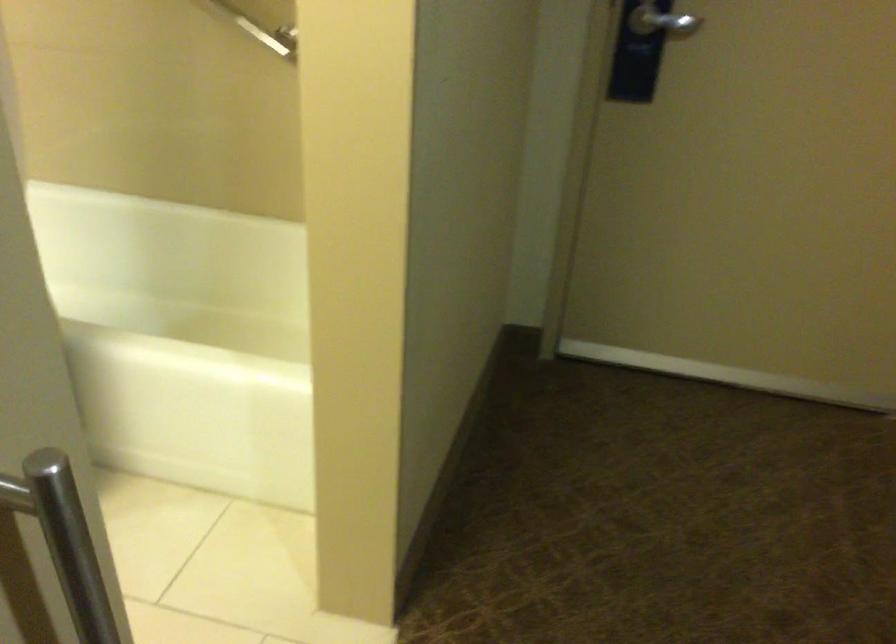
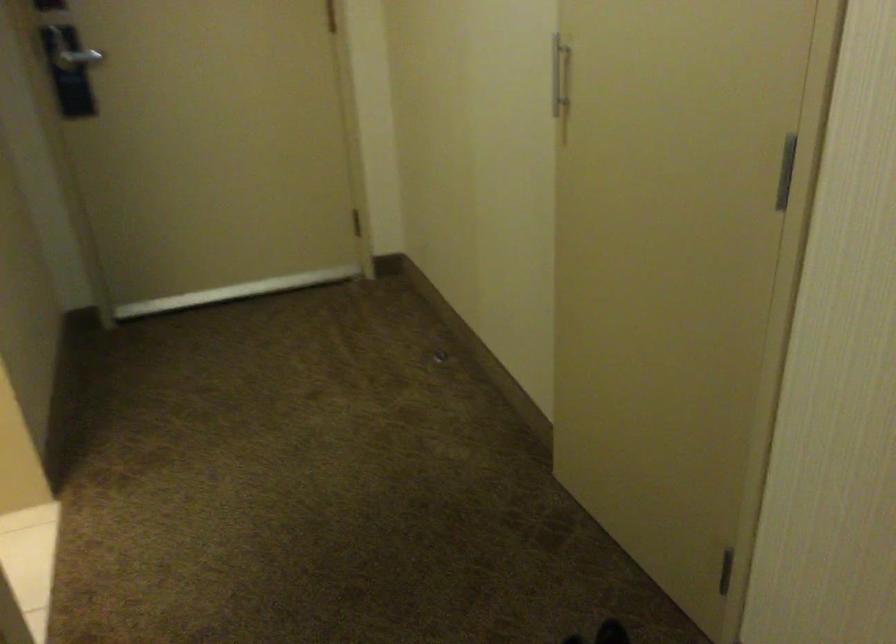
Question: How did the camera likely rotate?

Choices:
 (A) Left
 (B) Right
 (C) Up
 (D) Down

Answer: (B)